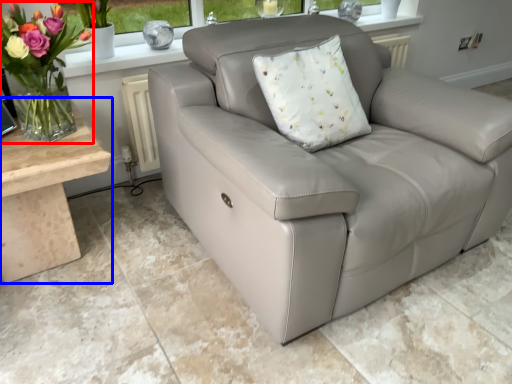
Question: Which of the following is the farthest to the observer, floral arrangement (highlighted by a red box) or table (highlighted by a blue box)?

Choices:
 (A) floral arrangement
 (B) table

Answer: (B)